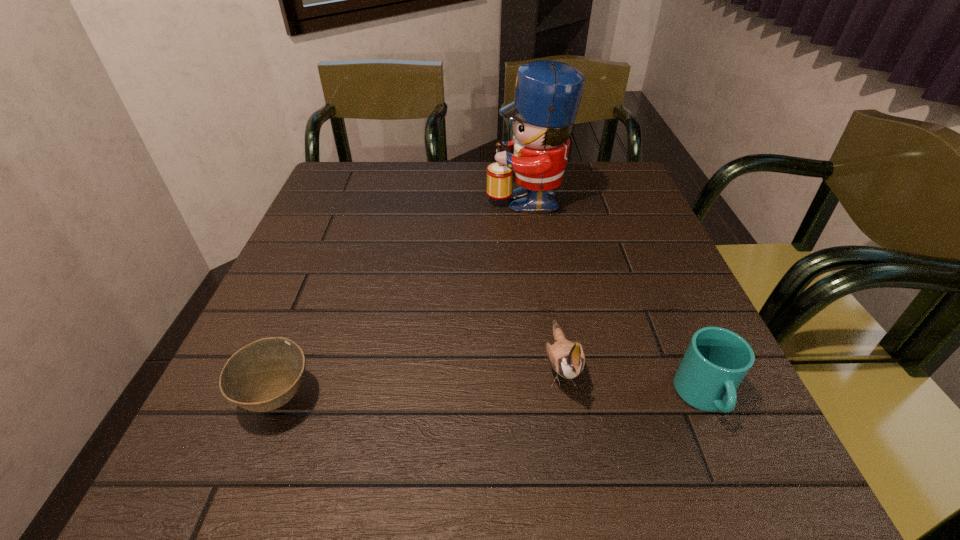
I want to click on free location located at the face of the bird, so click(578, 468).

The width and height of the screenshot is (960, 540). Identify the location of free space located on the right of the shortest object. (511, 397).

Find the location of a particular element. This screenshot has height=540, width=960. object located at the far edge is located at coordinates (548, 93).

Where is `object situated at the left edge`? This screenshot has height=540, width=960. object situated at the left edge is located at coordinates (264, 375).

Where is `object at the right edge`? This screenshot has width=960, height=540. object at the right edge is located at coordinates (717, 360).

I want to click on vacant area at the far edge of the desktop, so click(x=392, y=172).

This screenshot has width=960, height=540. I want to click on vacant region at the left edge of the desktop, so click(333, 230).

This screenshot has height=540, width=960. What are the coordinates of `vacant space at the right edge` in the screenshot? It's located at (607, 224).

This screenshot has width=960, height=540. I want to click on free space at the far left corner of the desktop, so click(354, 180).

Where is `vacant space at the far right corner of the desktop`? This screenshot has width=960, height=540. vacant space at the far right corner of the desktop is located at coordinates (585, 168).